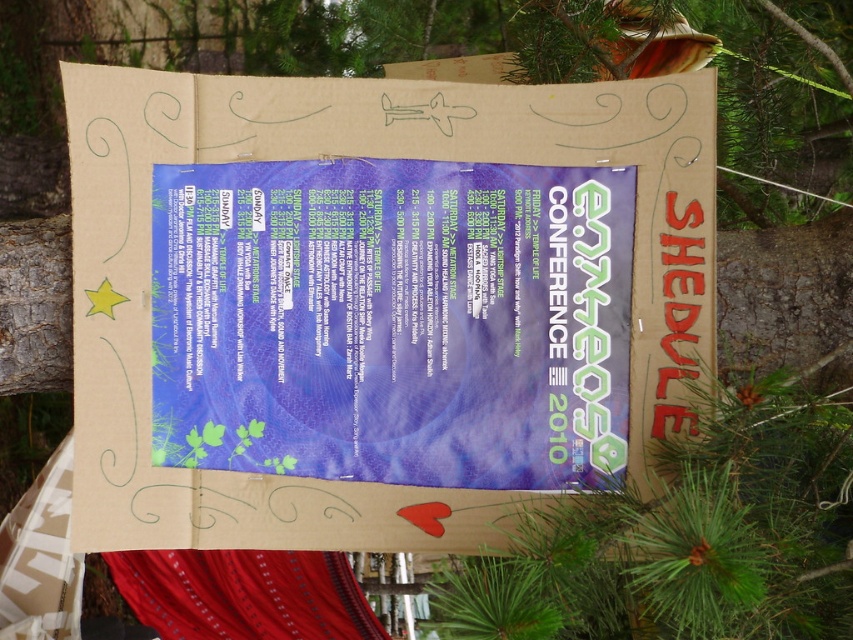
You need to determine if the brown cardboard at center can fully cover the matte blue poster at center when placed over it. Based on the scene description, what is your conclusion?

The brown cardboard at center is bigger than matte blue poster at center, so yes, the brown cardboard at center can fully cover the matte blue poster at center.

You have a rectangular box that is exactly the same width as the matte blue poster at center. If you want to place this box on the brown cardboard at center, will it fit entirely without overhanging on either side?

The brown cardboard at center might be wider than matte blue poster at center, so the box, which has the same width as the poster, could fit within the cardboard. However, since the exact width difference isn

You are organizing a conference and need to hang the brown cardboard at center and the matte blue poster at center on a wall. According to the image, which object should be placed higher on the wall?

The brown cardboard at center should be placed higher on the wall because it is positioned above the matte blue poster at center in the image.